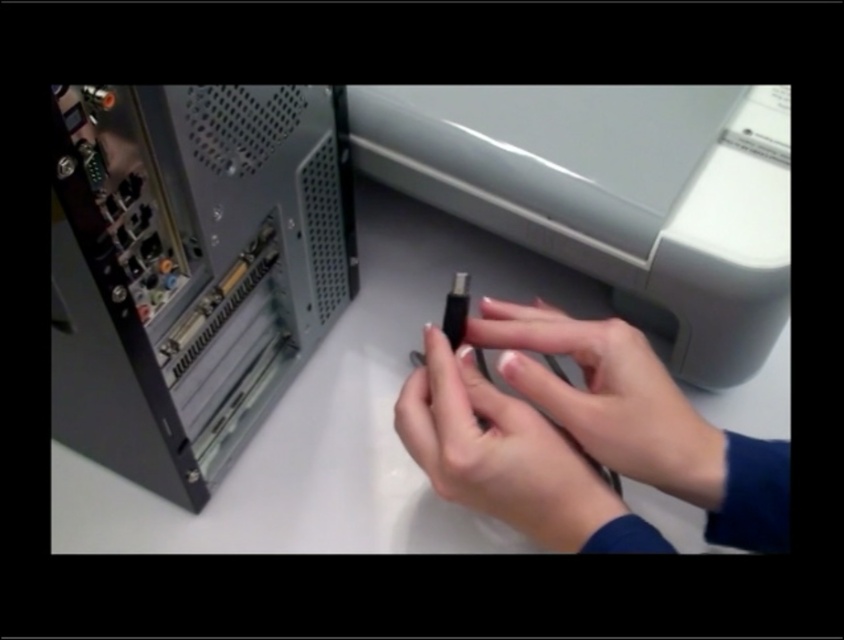
Measure the distance from smooth skin hands at center to smooth matte black usb drive at center.

They are 1.83 inches apart.

Does smooth skin hands at center appear over smooth matte black usb drive at center?

Indeed, smooth skin hands at center is positioned over smooth matte black usb drive at center.

Is point (629, 394) positioned before point (504, 461)?

No, it is behind (504, 461).

Identify the location of smooth skin hands at center. The height and width of the screenshot is (640, 844). (609, 396).

Who is higher up, matte gray printer at center or smooth skin hands at center?

matte gray printer at center is above.

Between point (686, 312) and point (602, 444), which one is positioned behind?

Point (686, 312)

I want to click on matte gray printer at center, so click(614, 195).

Does point (172, 410) lie behind point (490, 442)?

Yes, it is.

Is black plastic computer at center smaller than smooth matte black usb drive at center?

No.

The width and height of the screenshot is (844, 640). What do you see at coordinates (191, 268) in the screenshot?
I see `black plastic computer at center` at bounding box center [191, 268].

At what (x,y) coordinates should I click in order to perform the action: click on black plastic computer at center. Please return your answer as a coordinate pair (x, y). This screenshot has width=844, height=640. Looking at the image, I should click on (191, 268).